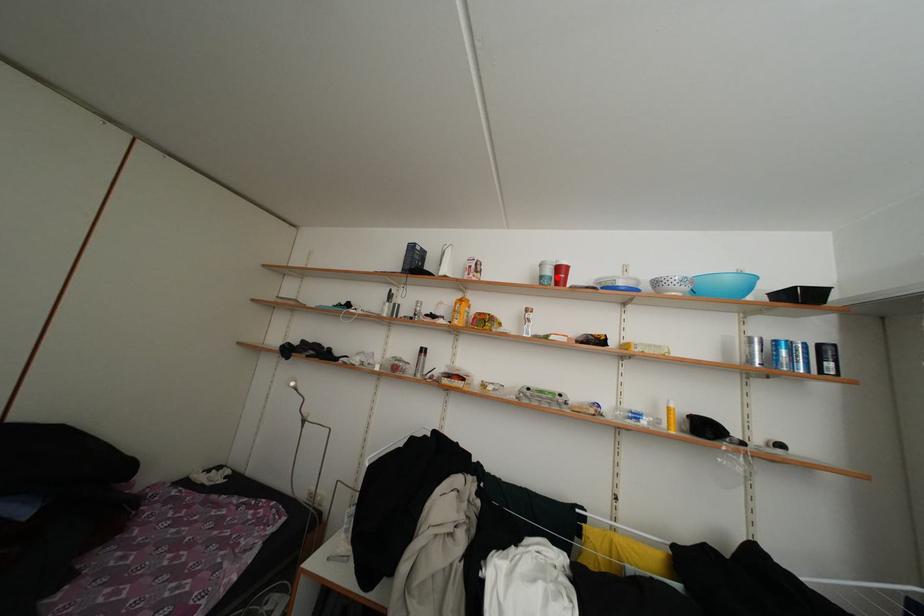
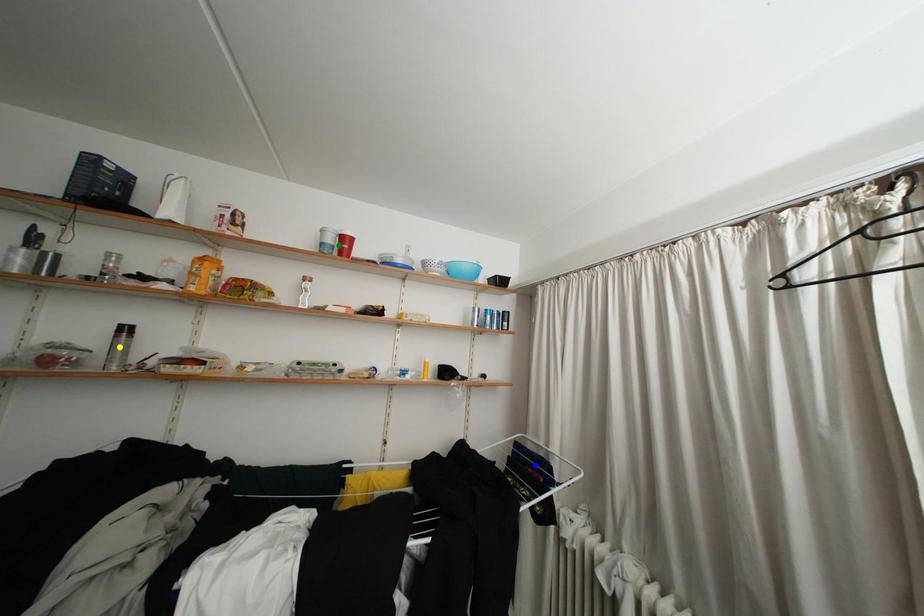
Question: I am providing you with two images of the same scene from different viewpoints. A red point is marked on the first image. You are given multiple points on the second image. In image 2, which mark is for the same physical point as the one in image 1?

Choices:
 (A) yellow point
 (B) green point
 (C) blue point

Answer: (B)